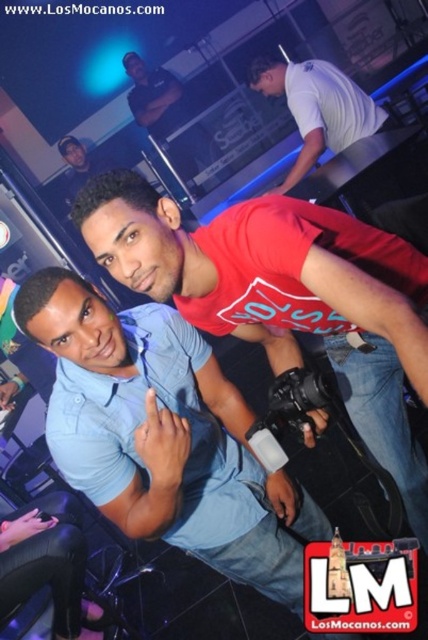
Can you confirm if matte blue shirt at center is thinner than white matte shirt at upper center?

In fact, matte blue shirt at center might be wider than white matte shirt at upper center.

Can you confirm if matte blue shirt at center is positioned below white matte shirt at upper center?

Yes, matte blue shirt at center is below white matte shirt at upper center.

Find the location of a particular element. The width and height of the screenshot is (428, 640). matte blue shirt at center is located at coordinates pos(285,296).

Image resolution: width=428 pixels, height=640 pixels. I want to click on matte blue shirt at center, so click(x=285, y=296).

In the scene shown: Which is below, matte blue shirt at center or matte black shirt at upper center?

matte blue shirt at center is lower down.

The height and width of the screenshot is (640, 428). What are the coordinates of `matte blue shirt at center` in the screenshot? It's located at (285, 296).

The image size is (428, 640). What do you see at coordinates (285, 296) in the screenshot?
I see `matte blue shirt at center` at bounding box center [285, 296].

The image size is (428, 640). Find the location of `matte blue shirt at center`. matte blue shirt at center is located at coordinates (285, 296).

Who is positioned more to the right, white matte shirt at upper center or matte black shirt at upper center?

white matte shirt at upper center is more to the right.

Image resolution: width=428 pixels, height=640 pixels. Describe the element at coordinates (317, 108) in the screenshot. I see `white matte shirt at upper center` at that location.

Identify the location of white matte shirt at upper center. (317, 108).